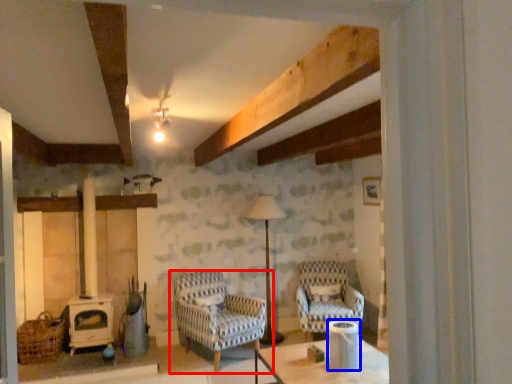
Question: Which point is further to the camera, chair (highlighted by a red box) or appliance (highlighted by a blue box)?

Choices:
 (A) chair
 (B) appliance

Answer: (A)